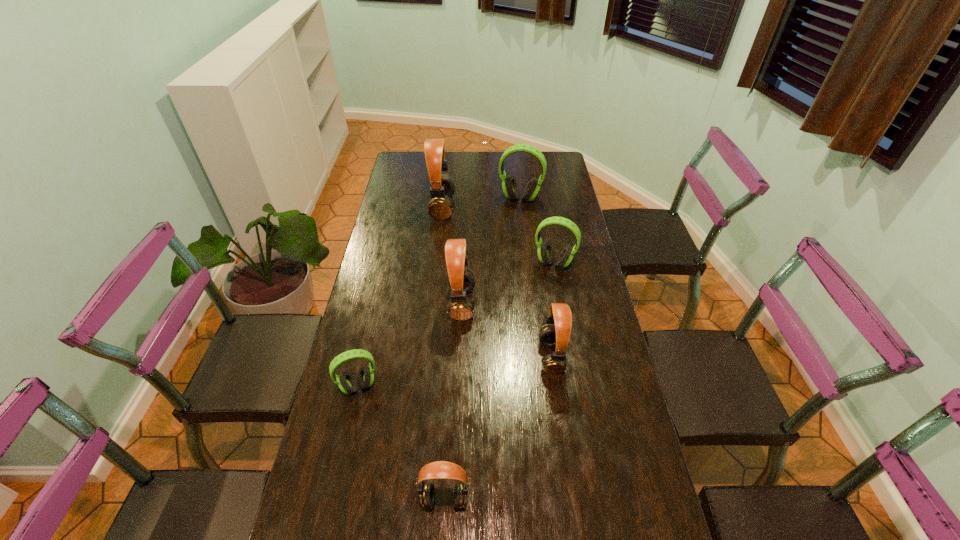
Locate an element on the screen. The image size is (960, 540). free point between the smallest green headset and the biggest green headset is located at coordinates (440, 293).

The height and width of the screenshot is (540, 960). Identify the location of vacant region between the nearest headset and the second smallest green headset. tap(499, 382).

Locate an element on the screen. The height and width of the screenshot is (540, 960). object that is the closest to the tallest object is located at coordinates (510, 187).

You are a GUI agent. You are given a task and a screenshot of the screen. Output one action in this format:
    pyautogui.click(x=<x>, y=<y>)
    Task: Click on the fifth closest object to the second farthest green headset
    
    Given the screenshot: What is the action you would take?
    pyautogui.click(x=347, y=384)

Locate which headset is the third closest to the farthest green headset. Please provide its 2D coordinates. Your answer should be formatted as a tuple, i.e. [(x, y)], where the tuple contains the x and y coordinates of a point satisfying the conditions above.

[(461, 280)]

Find the location of a particular element. the second closest headset relative to the farthest green headset is located at coordinates (545, 251).

I want to click on the second closest brown headset relative to the biggest green headset, so click(x=461, y=280).

The width and height of the screenshot is (960, 540). Find the location of `brown headset that can be found as the second closest to the farthest brown headset`. brown headset that can be found as the second closest to the farthest brown headset is located at coordinates (558, 335).

Image resolution: width=960 pixels, height=540 pixels. In order to click on the closest green headset relative to the farthest brown headset in this screenshot , I will do `click(510, 187)`.

The height and width of the screenshot is (540, 960). In order to click on the closest green headset to the second nearest green headset in this screenshot , I will do `click(510, 187)`.